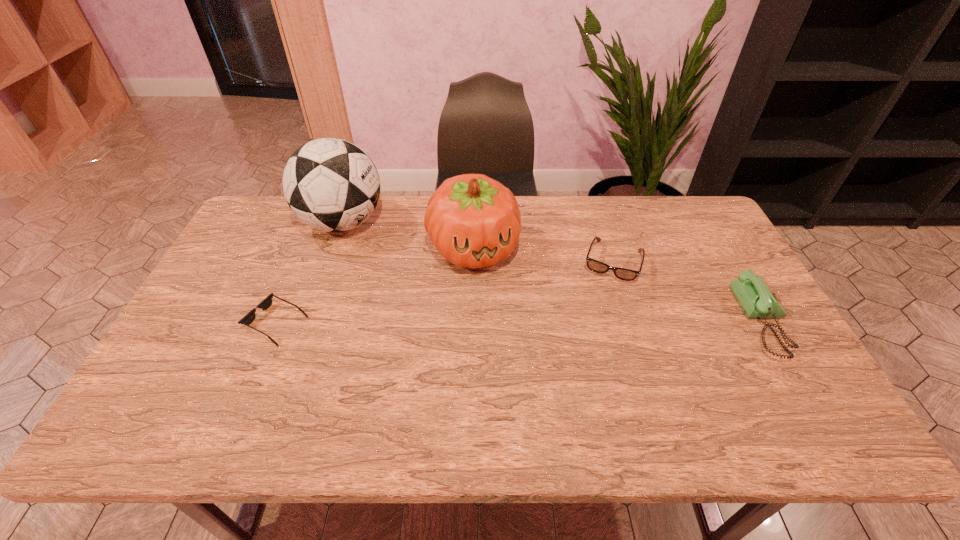
Where is `free space between the telephone and the fourth tallest object`? The width and height of the screenshot is (960, 540). free space between the telephone and the fourth tallest object is located at coordinates click(688, 292).

At what (x,y) coordinates should I click in order to perform the action: click on unoccupied area between the third object from left to right and the shortest object. Please return your answer as a coordinate pair (x, y). This screenshot has width=960, height=540. Looking at the image, I should click on (374, 285).

Where is `free space between the third object from right to left and the soccer ball`? The width and height of the screenshot is (960, 540). free space between the third object from right to left and the soccer ball is located at coordinates (408, 235).

Where is `free spot between the third shortest object and the soccer ball`? This screenshot has width=960, height=540. free spot between the third shortest object and the soccer ball is located at coordinates click(553, 272).

Identify the location of unoccupied area between the sunglasses and the soccer ball. (310, 273).

Where is `free space between the spectacles and the sunglasses`? This screenshot has width=960, height=540. free space between the spectacles and the sunglasses is located at coordinates (444, 293).

Image resolution: width=960 pixels, height=540 pixels. What are the coordinates of `free space between the third object from left to right and the soccer ball` in the screenshot? It's located at (408, 235).

Image resolution: width=960 pixels, height=540 pixels. I want to click on empty space that is in between the spectacles and the pumpkin, so click(x=542, y=255).

At what (x,y) coordinates should I click in order to perform the action: click on the fourth closest object relative to the second object from right to left. Please return your answer as a coordinate pair (x, y). The width and height of the screenshot is (960, 540). Looking at the image, I should click on (248, 319).

At what (x,y) coordinates should I click in order to perform the action: click on object that stands as the second closest to the pumpkin. Please return your answer as a coordinate pair (x, y). The height and width of the screenshot is (540, 960). Looking at the image, I should click on (596, 266).